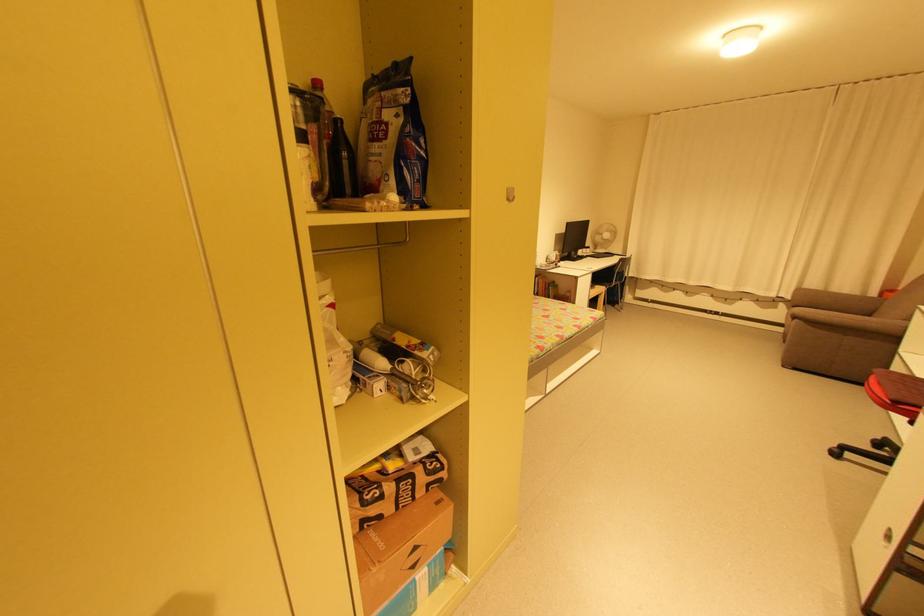
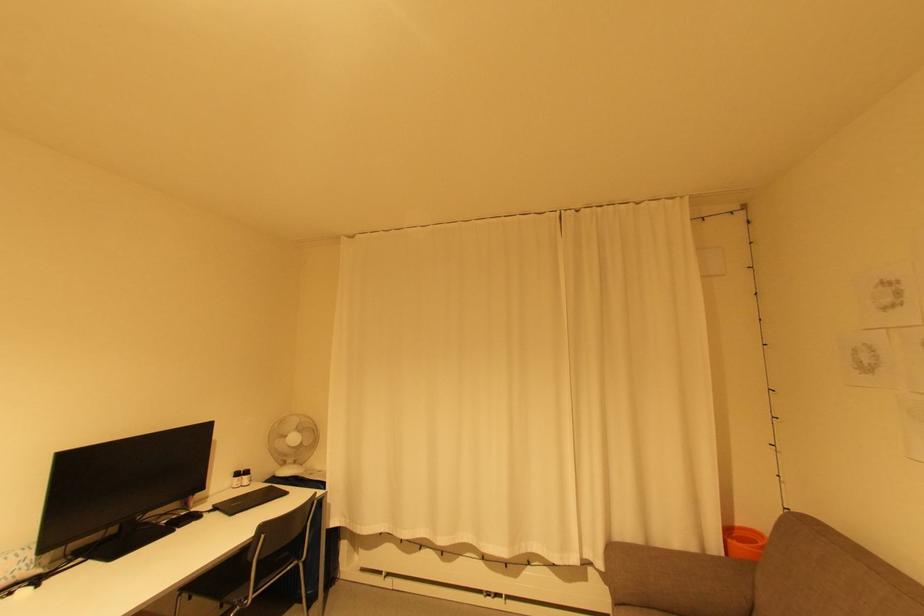
The point at [622,273] is marked in the first image. Where is the corresponding point in the second image?

(262, 562)